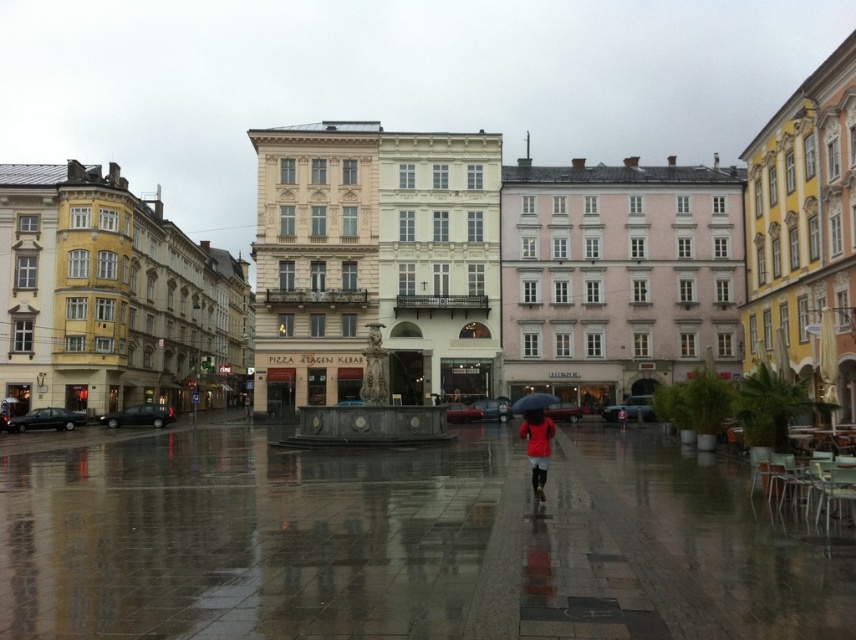
You are a pedestrian in the square holding the blue matte umbrella at center. You want to keep the red matte coat at center dry. Is the umbrella currently positioned to protect the coat from rain?

The red matte coat at center is below the blue matte umbrella at center, so yes, the umbrella is positioned above the coat and should be protecting it from the rain.

You are a delivery person carrying a 1.2 meter wide package and need to place it in the square. The package must be placed between the red matte coat at center and the blue matte umbrella at center. Is there enough space between them to fit the package?

The red matte coat at center is narrower than the blue matte umbrella at center. However, the combined space between them isn

Based on the photo, you are a tourist holding a camera and want to take a photo of the red matte coat at center and the ornate fountain in the square. If the distance between them is exactly 54.34 meters, can you capture both in a single frame without moving your camera? Explain your reasoning.

The distance between the red matte coat at center and the ornate fountain is 54.34 meters. Since the camera has a wide enough angle to capture both objects at this distance, it is possible to include both in a single frame without moving the camera.